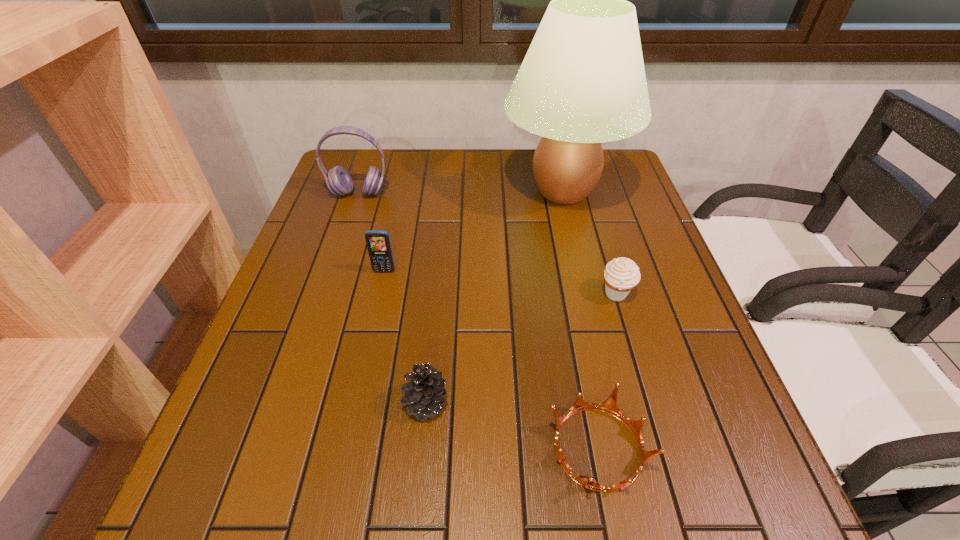
Image resolution: width=960 pixels, height=540 pixels. In order to click on vacant space in between the second tallest object and the muffin in this screenshot , I will do `click(488, 244)`.

Choose which object is the third nearest neighbor to the second object from left to right. Please provide its 2D coordinates. Your answer should be formatted as a tuple, i.e. [(x, y)], where the tuple contains the x and y coordinates of a point satisfying the conditions above.

[(425, 391)]

At what (x,y) coordinates should I click in order to perform the action: click on object that stands as the closest to the crown. Please return your answer as a coordinate pair (x, y). The height and width of the screenshot is (540, 960). Looking at the image, I should click on (425, 391).

This screenshot has width=960, height=540. In order to click on free region that satisfies the following two spatial constraints: 1. on the headband and ear cups of the leftmost object; 2. on the left side of the shortest object in this screenshot , I will do `click(273, 448)`.

Locate an element on the screen. Image resolution: width=960 pixels, height=540 pixels. free region that satisfies the following two spatial constraints: 1. on the headband and ear cups of the shortest object; 2. on the left side of the second tallest object is located at coordinates (273, 448).

Find the location of a particular element. The height and width of the screenshot is (540, 960). vacant space that satisfies the following two spatial constraints: 1. on the shade of the lampshade; 2. on the headband and ear cups of the leftmost object is located at coordinates (564, 193).

Find the location of `free region that satisfies the following two spatial constraints: 1. on the shade of the tallest object; 2. on the back side of the third nearest object`. free region that satisfies the following two spatial constraints: 1. on the shade of the tallest object; 2. on the back side of the third nearest object is located at coordinates (588, 294).

What are the coordinates of `free space that satisfies the following two spatial constraints: 1. on the shade of the third nearest object; 2. on the right side of the tallest object` in the screenshot? It's located at (588, 294).

Identify the location of vacant region that satisfies the following two spatial constraints: 1. on the shade of the lampshade; 2. on the headband and ear cups of the headset. This screenshot has height=540, width=960. (564, 193).

Find the location of a particular element. This screenshot has height=540, width=960. free space that satisfies the following two spatial constraints: 1. on the headband and ear cups of the shortest object; 2. on the left side of the fifth shortest object is located at coordinates (273, 448).